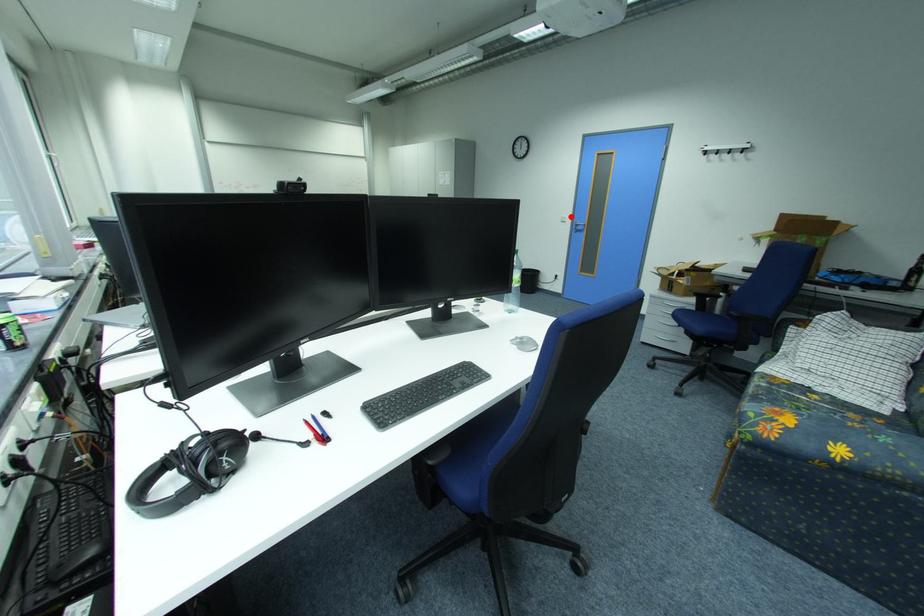
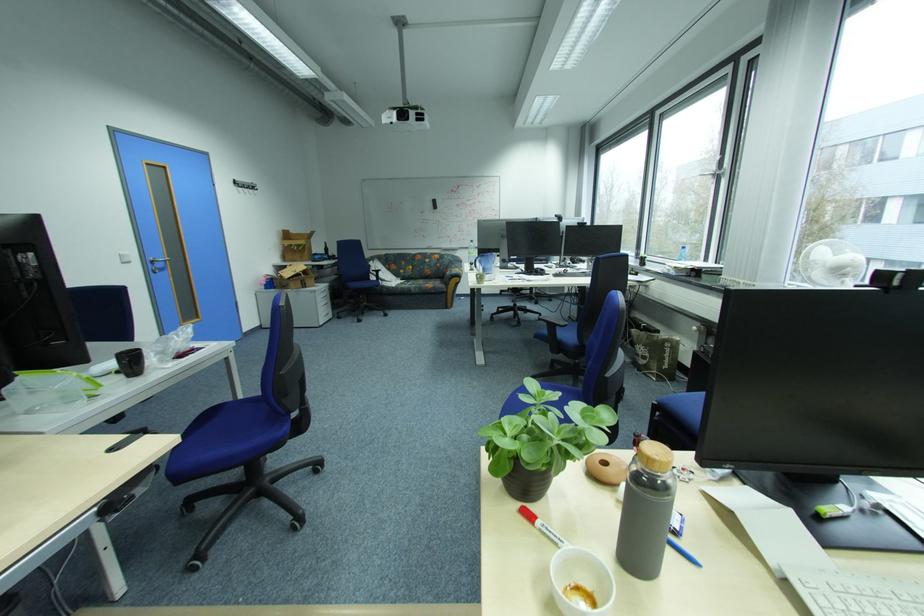
The point at the highlighted location is marked in the first image. Where is the corresponding point in the second image?

(130, 254)